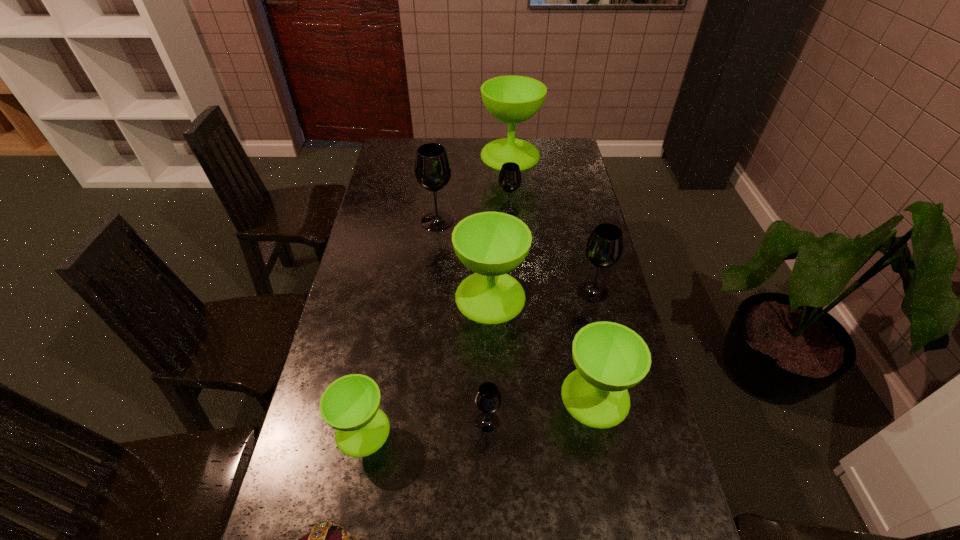
Where is `object that stands as the sixth closest to the smallest green wineglass`? The image size is (960, 540). object that stands as the sixth closest to the smallest green wineglass is located at coordinates (432, 168).

Point out which object is positioned as the second nearest to the biggest green wineglass. Please provide its 2D coordinates. Your answer should be formatted as a tuple, i.e. [(x, y)], where the tuple contains the x and y coordinates of a point satisfying the conditions above.

[(432, 168)]

This screenshot has width=960, height=540. Identify the location of the sixth closest wineglass to the second biggest gray wineglass. (350, 404).

This screenshot has height=540, width=960. I want to click on wineglass that is the sixth closest to the second biggest green wineglass, so click(350, 404).

Point out which green wineglass is positioned as the fourth nearest to the second wineglass from left to right. Please provide its 2D coordinates. Your answer should be formatted as a tuple, i.e. [(x, y)], where the tuple contains the x and y coordinates of a point satisfying the conditions above.

[(350, 404)]

Choose which green wineglass is the third nearest neighbor to the third gray wineglass from left to right. Please provide its 2D coordinates. Your answer should be formatted as a tuple, i.e. [(x, y)], where the tuple contains the x and y coordinates of a point satisfying the conditions above.

[(610, 358)]

Choose which gray wineglass is the second nearest neighbor to the second biggest green wineglass. Please provide its 2D coordinates. Your answer should be formatted as a tuple, i.e. [(x, y)], where the tuple contains the x and y coordinates of a point satisfying the conditions above.

[(432, 168)]

You are a GUI agent. You are given a task and a screenshot of the screen. Output one action in this format:
    pyautogui.click(x=<x>, y=<y>)
    Task: Click on the fourth closest gray wineglass relative to the crown
    The width and height of the screenshot is (960, 540).
    Given the screenshot: What is the action you would take?
    pyautogui.click(x=509, y=179)

Identify the location of free space that satisfies the following two spatial constraints: 1. on the back side of the leftmost green wineglass; 2. on the right side of the second farthest green wineglass. (389, 296).

This screenshot has height=540, width=960. Find the location of `vacant point that satisfies the following two spatial constraints: 1. on the back side of the third gray wineglass from left to right; 2. on the right side of the second biggest green wineglass`. vacant point that satisfies the following two spatial constraints: 1. on the back side of the third gray wineglass from left to right; 2. on the right side of the second biggest green wineglass is located at coordinates (489, 212).